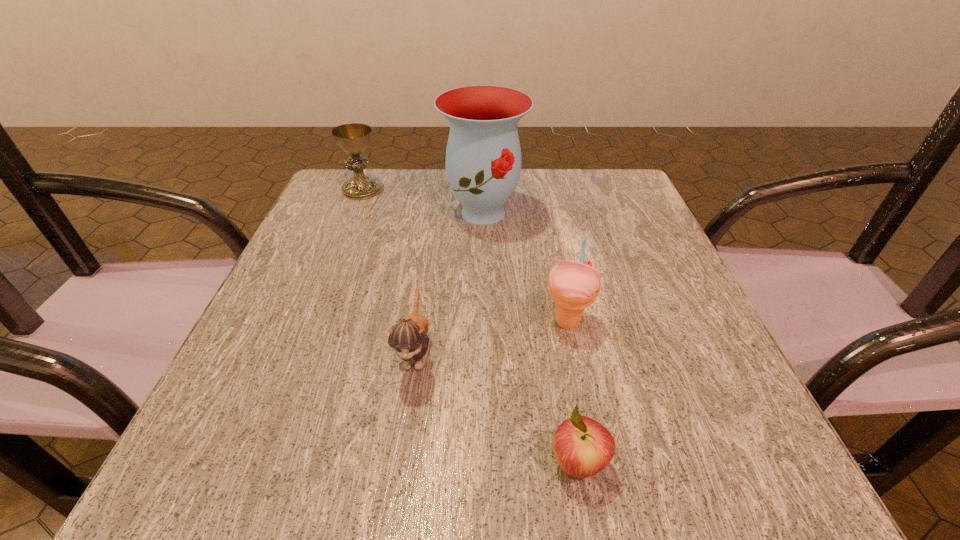
I want to click on free space between the vase and the icecream, so [x=525, y=267].

Identify the location of blank region between the kitten and the nearest object. Image resolution: width=960 pixels, height=540 pixels. (496, 407).

Where is `free point between the chalice and the vase`? This screenshot has height=540, width=960. free point between the chalice and the vase is located at coordinates (422, 201).

You are a GUI agent. You are given a task and a screenshot of the screen. Output one action in this format:
    pyautogui.click(x=<x>, y=<y>)
    Task: Click on the object that is the fourth closest one to the tallest object
    
    Given the screenshot: What is the action you would take?
    pyautogui.click(x=582, y=446)

Where is `object that is the third nearest to the icecream`? object that is the third nearest to the icecream is located at coordinates (483, 156).

In order to click on vacant position in the image that satisfies the following two spatial constraints: 1. on the front side of the vase; 2. on the left side of the apple in this screenshot , I will do `click(486, 464)`.

This screenshot has height=540, width=960. In order to click on vacant space that satisfies the following two spatial constraints: 1. on the back side of the nearest object; 2. on the right side of the icecream in this screenshot , I will do `click(553, 322)`.

Locate an element on the screen. vacant space that satisfies the following two spatial constraints: 1. on the front-facing side of the kitten; 2. on the left side of the apple is located at coordinates (399, 464).